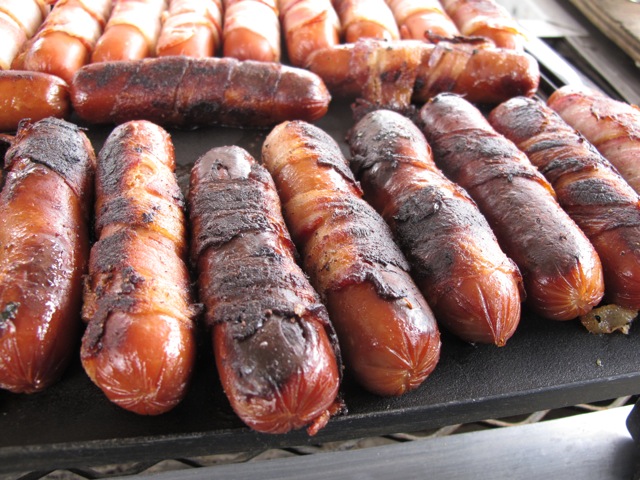
Identify the location of wooden surface. (623, 17).